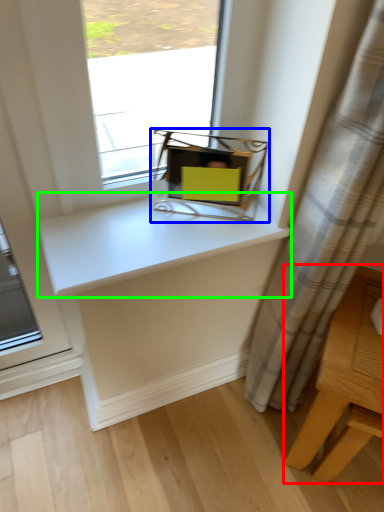
Question: Considering the real-world distances, which object is farthest from table (highlighted by a red box)? equipment (highlighted by a blue box) or counter top (highlighted by a green box)?

Choices:
 (A) equipment
 (B) counter top

Answer: (A)